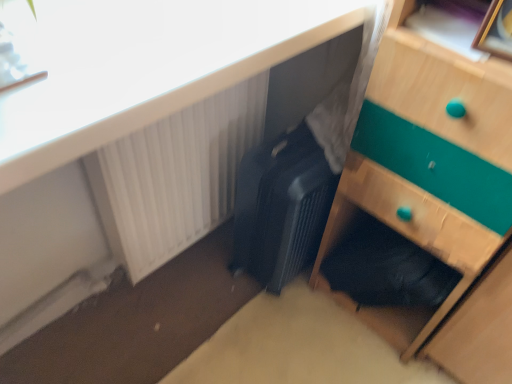
Question: From the image's perspective, is matte black suitcase at center positioned above or below black textured suitcase at center?

Choices:
 (A) above
 (B) below

Answer: (A)

Question: Based on their sizes in the image, would you say matte black suitcase at center is bigger or smaller than black textured suitcase at center?

Choices:
 (A) small
 (B) big

Answer: (A)

Question: Estimate the real-world distances between objects in this image. Which object is farther from the wooden picture frame at upper right?

Choices:
 (A) matte black suitcase at center
 (B) wooden chest of drawers at lower right
 (C) black textured suitcase at center
 (D) white plastic radiator at upper left

Answer: (A)

Question: Which object is positioned farthest from the black textured suitcase at center?

Choices:
 (A) white plastic radiator at upper left
 (B) matte black suitcase at center
 (C) wooden chest of drawers at lower right
 (D) wooden picture frame at upper right

Answer: (D)